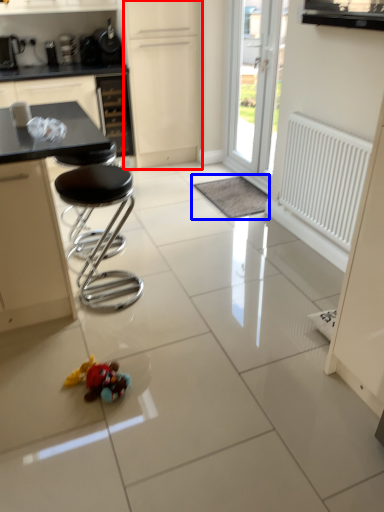
Question: Which object appears farthest to the camera in this image, screen door (highlighted by a red box) or wide (highlighted by a blue box)?

Choices:
 (A) screen door
 (B) wide

Answer: (A)